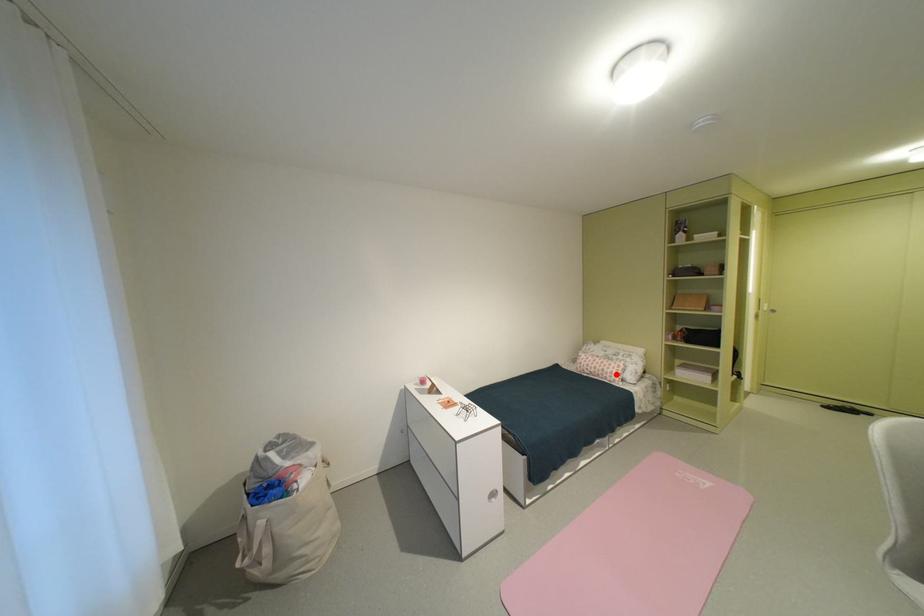
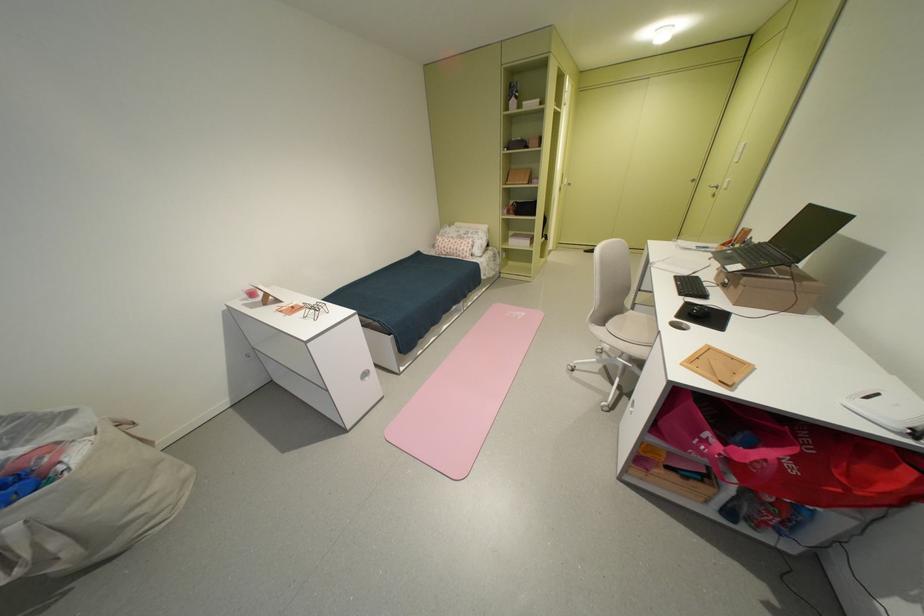
Where in the second image is the point corresponding to the highlighted location from the first image?

(468, 252)